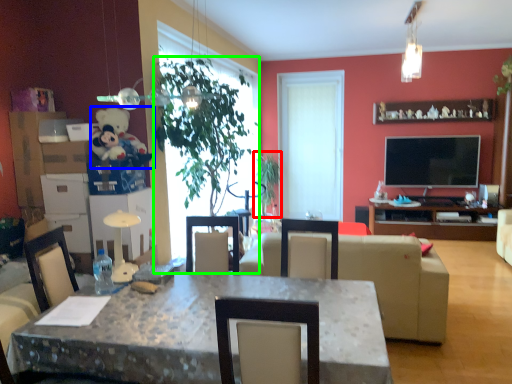
Question: Which object is positioned closest to plant (highlighted by a red box)? Select from teddy bear (highlighted by a blue box) and houseplant (highlighted by a green box).

Choices:
 (A) teddy bear
 (B) houseplant

Answer: (B)